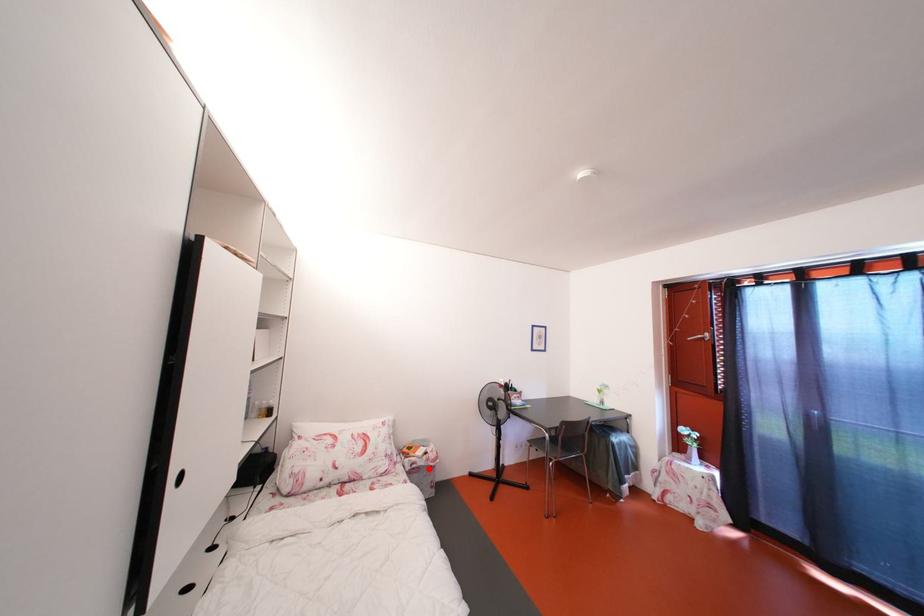
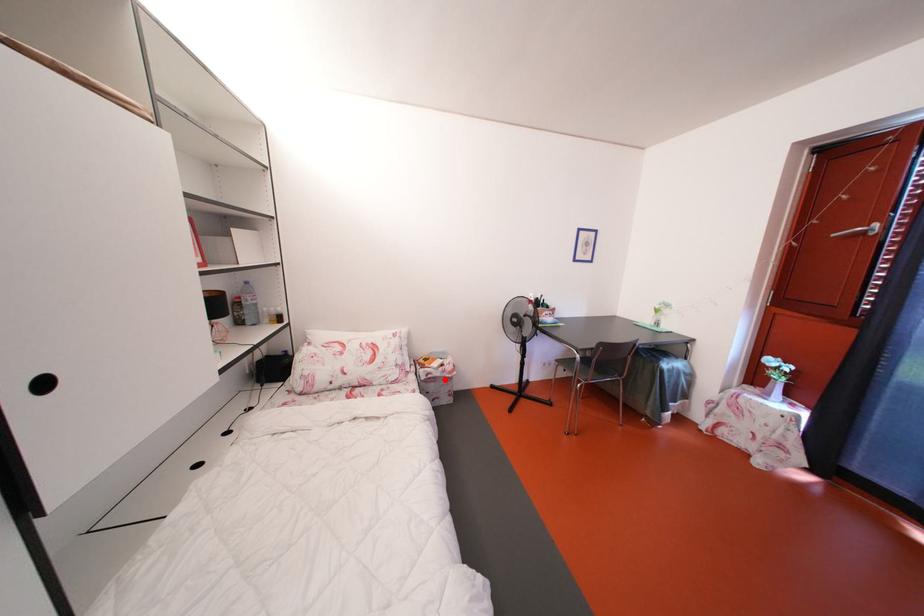
I am providing you with two images of the same scene from different viewpoints. A red point is marked on the first image and another point is marked on the second image. Do the highlighted points in image1 and image2 indicate the same real-world spot?

Yes